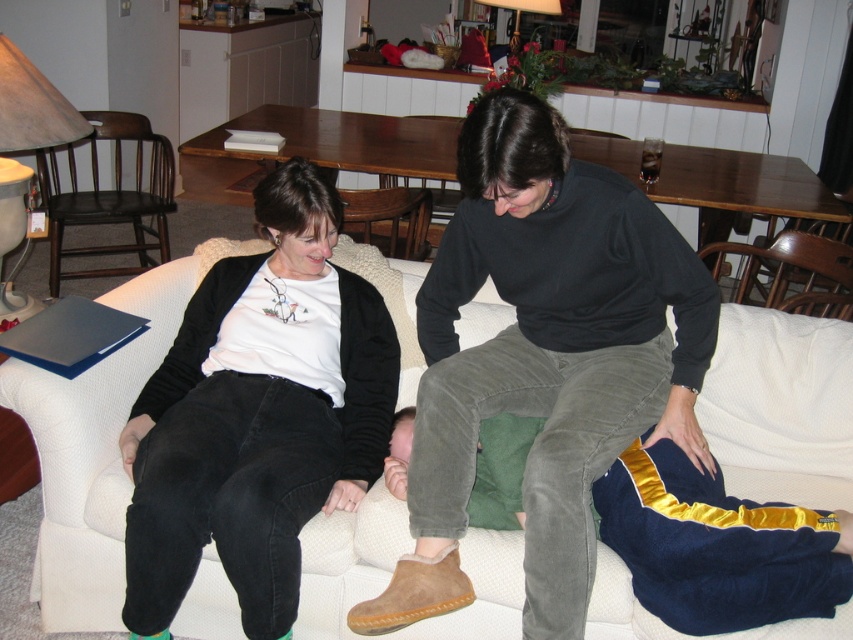
You are taking a photo of the two points in the image. Which point, point (827, 600) or point (819, 292), will appear larger in the photo?

Point (827, 600) will appear larger in the photo because it is closer to the camera than point (819, 292).

You are standing in front of the living room couch where two people are sitting. You notice two points marked in the scene. The first point is at coordinates point (814, 611) and the second is at point (4, 113). Which of these two points is nearer to you?

Point (814, 611) is closer to the viewer than point (4, 113).